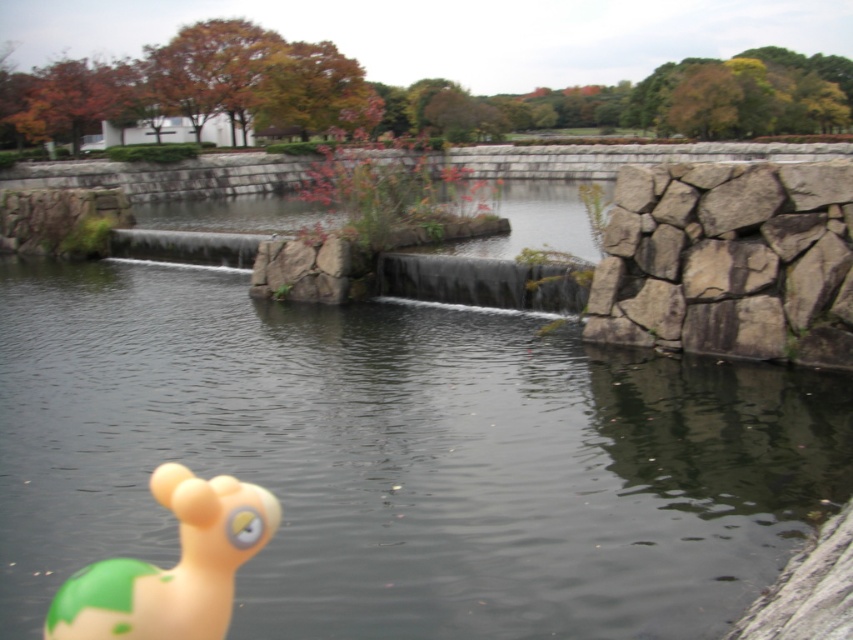
You are a child who wants to play with both the transparent water at center and the gray rough stone at right. Which object is bigger in size?

The transparent water at center has a larger size compared to the gray rough stone at right.

You are standing in the serene outdoor scene with the water feature. There is a transparent water at center located at point (401,458). Can you confirm if the transparent water at center is exactly at the coordinates provided?

Yes, the transparent water at center is exactly located at point (401,458) as stated in the description.